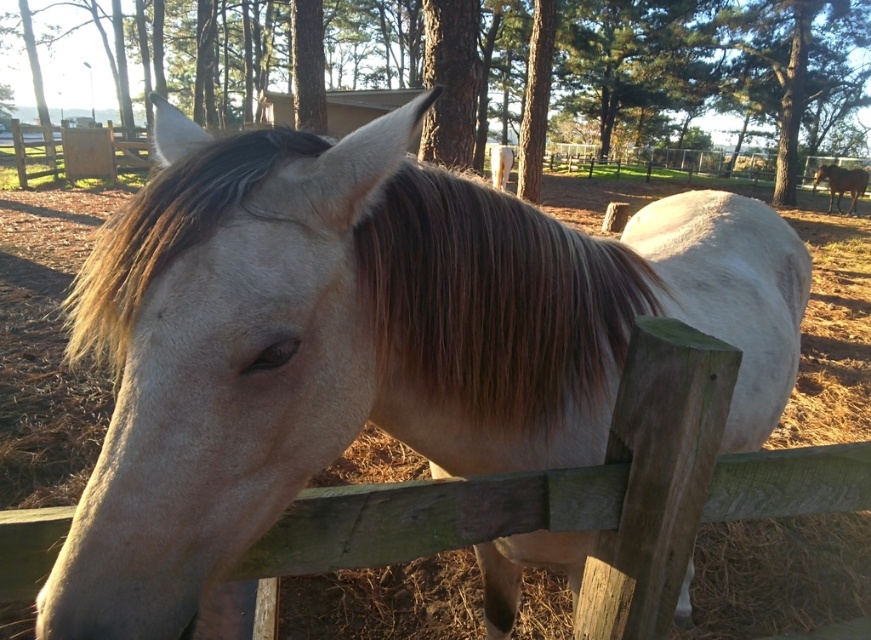
Question: Is brown silky mane at center thinner than brown glossy horse at upper right?

Choices:
 (A) yes
 (B) no

Answer: (B)

Question: Is brown silky mane at center further to camera compared to brown glossy horse at upper right?

Choices:
 (A) no
 (B) yes

Answer: (A)

Question: Which point is closer to the camera?

Choices:
 (A) (831, 177)
 (B) (115, 356)

Answer: (B)

Question: Which of the following is the farthest from the observer?

Choices:
 (A) brown silky mane at center
 (B) brown glossy horse at upper right

Answer: (B)

Question: Which of the following is the farthest from the observer?

Choices:
 (A) (206, 208)
 (B) (821, 164)

Answer: (B)

Question: Does brown silky mane at center appear on the left side of brown glossy horse at upper right?

Choices:
 (A) no
 (B) yes

Answer: (B)